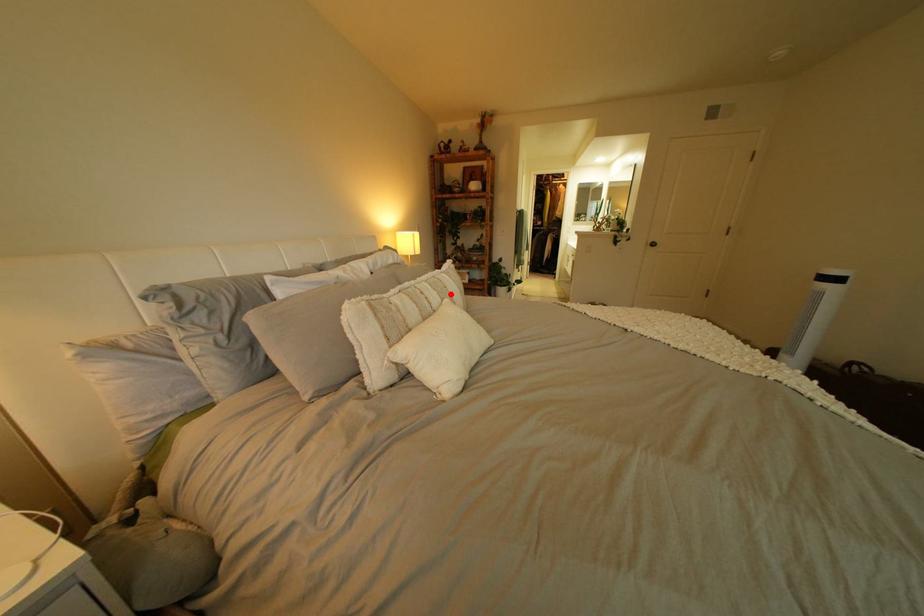
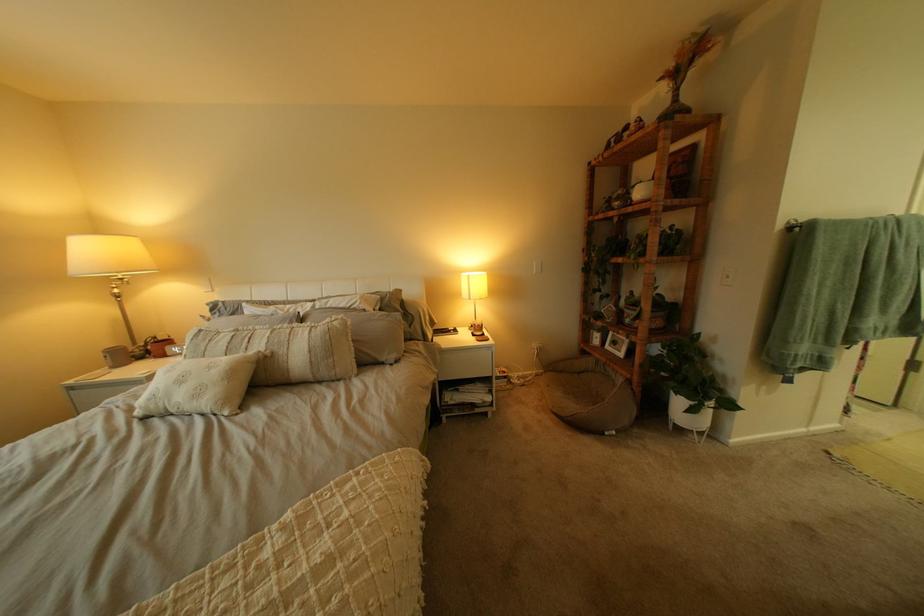
The point at the highlighted location is marked in the first image. Where is the corresponding point in the second image?

(281, 342)